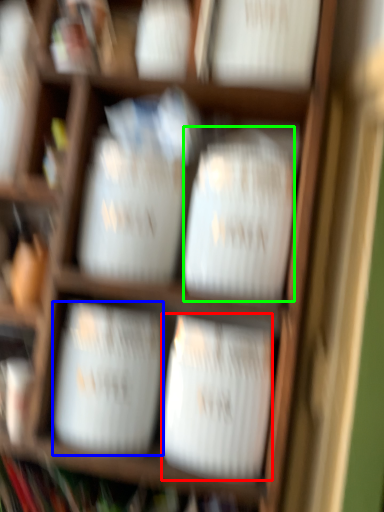
Question: Which object is the closest to the wide (highlighted by a red box)? Choose among these: wide (highlighted by a blue box) or wide (highlighted by a green box).

Choices:
 (A) wide
 (B) wide

Answer: (A)